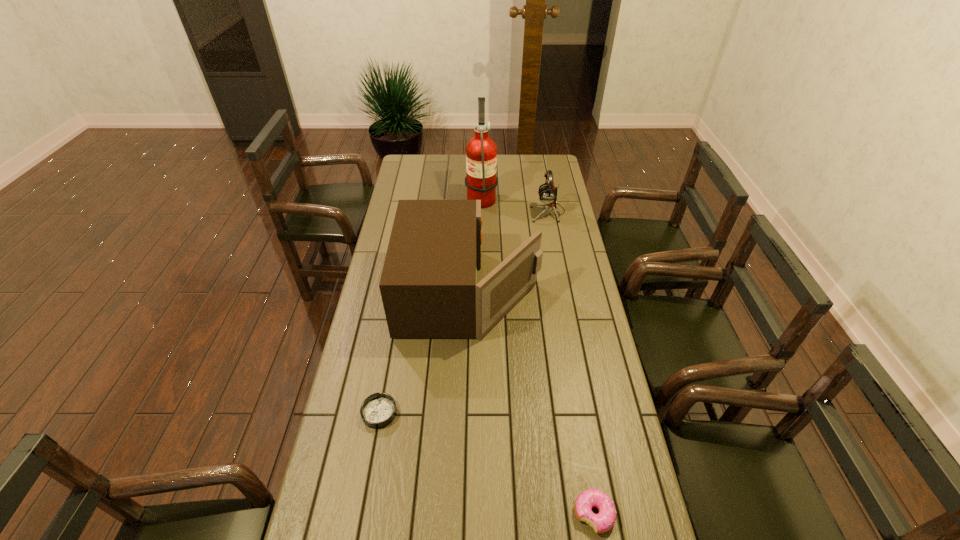
Locate an element on the screen. the tallest object is located at coordinates (481, 151).

At what (x,y) coordinates should I click in order to perform the action: click on the fourth shortest object. Please return your answer as a coordinate pair (x, y). This screenshot has height=540, width=960. Looking at the image, I should click on (428, 285).

This screenshot has height=540, width=960. I want to click on the third farthest object, so click(428, 285).

Find the location of a particular element. earphone is located at coordinates (547, 194).

Where is `the second shortest object`? the second shortest object is located at coordinates (602, 522).

Find the location of a particular element. The height and width of the screenshot is (540, 960). doughnut is located at coordinates (602, 522).

Identify the location of ashtray. (378, 410).

Image resolution: width=960 pixels, height=540 pixels. What are the coordinates of `the shortest object` in the screenshot? It's located at (378, 410).

This screenshot has width=960, height=540. In order to click on vacant region located on the nozzle and handle of the fire extinguisher in this screenshot , I will do `click(455, 197)`.

The height and width of the screenshot is (540, 960). I want to click on vacant region located on the nozzle and handle of the fire extinguisher, so click(422, 197).